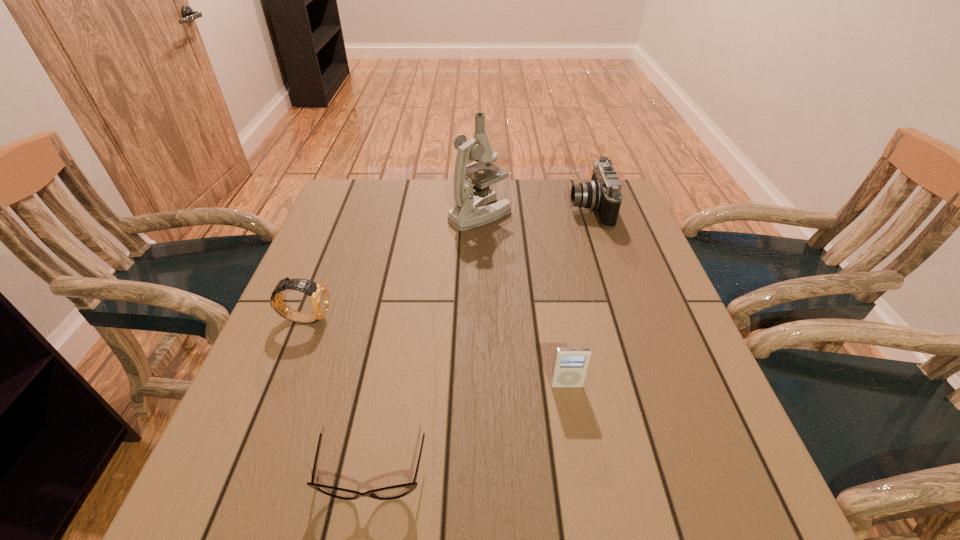
In order to click on free space that satisfies the following two spatial constraints: 1. on the front-facing side of the rightmost object; 2. on the front side of the microscope in this screenshot , I will do `click(591, 214)`.

Identify the location of free space that satisfies the following two spatial constraints: 1. on the front-facing side of the fourth shortest object; 2. on the front-facing side of the nearest object. (678, 476).

The image size is (960, 540). I want to click on vacant space that satisfies the following two spatial constraints: 1. on the front-facing side of the rightmost object; 2. on the front-facing side of the nearest object, so (678, 476).

You are a GUI agent. You are given a task and a screenshot of the screen. Output one action in this format:
    pyautogui.click(x=<x>, y=<y>)
    Task: Click on the free space that satisfies the following two spatial constraints: 1. on the front-facing side of the rightmost object; 2. on the front-facing side of the nearest object
    
    Given the screenshot: What is the action you would take?
    [678, 476]